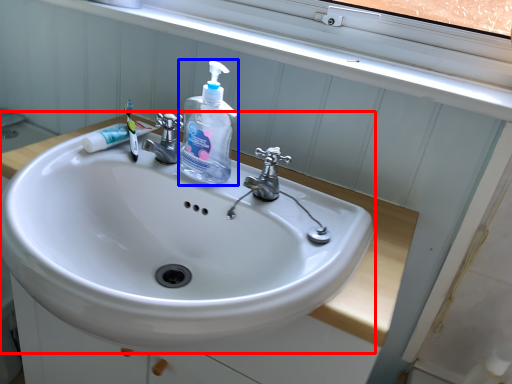
Question: Among these objects, which one is nearest to the camera, sink (highlighted by a red box) or cleaning product (highlighted by a blue box)?

Choices:
 (A) sink
 (B) cleaning product

Answer: (A)